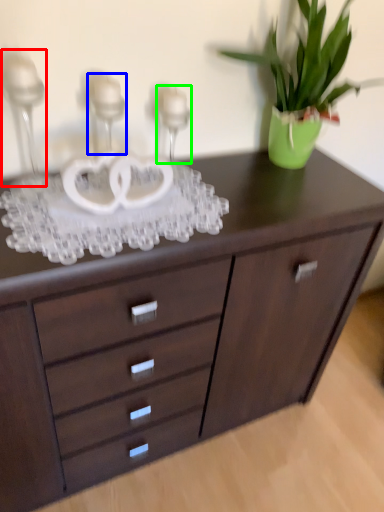
Question: Which object is the farthest from candle holder (highlighted by a red box)? Choose among these: candle holder (highlighted by a blue box) or candle holder (highlighted by a green box).

Choices:
 (A) candle holder
 (B) candle holder

Answer: (B)